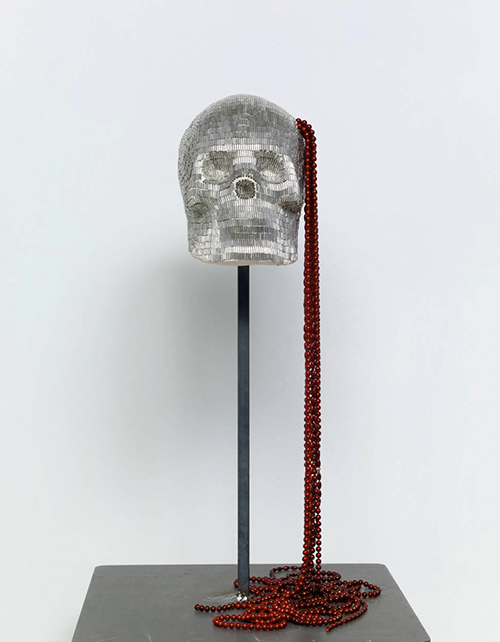
I want to click on table, so click(153, 619).